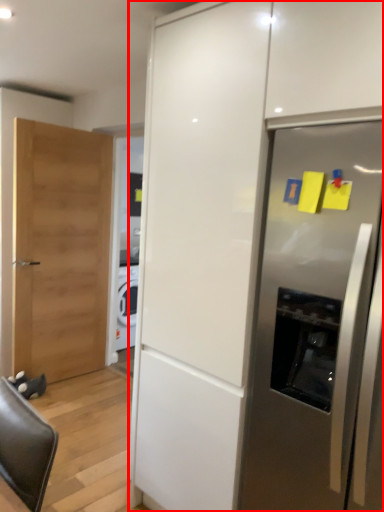
Question: From the image's perspective, what is the correct spatial positioning of cabinetry (annotated by the red box) in reference to refrigerator?

Choices:
 (A) above
 (B) below

Answer: (A)